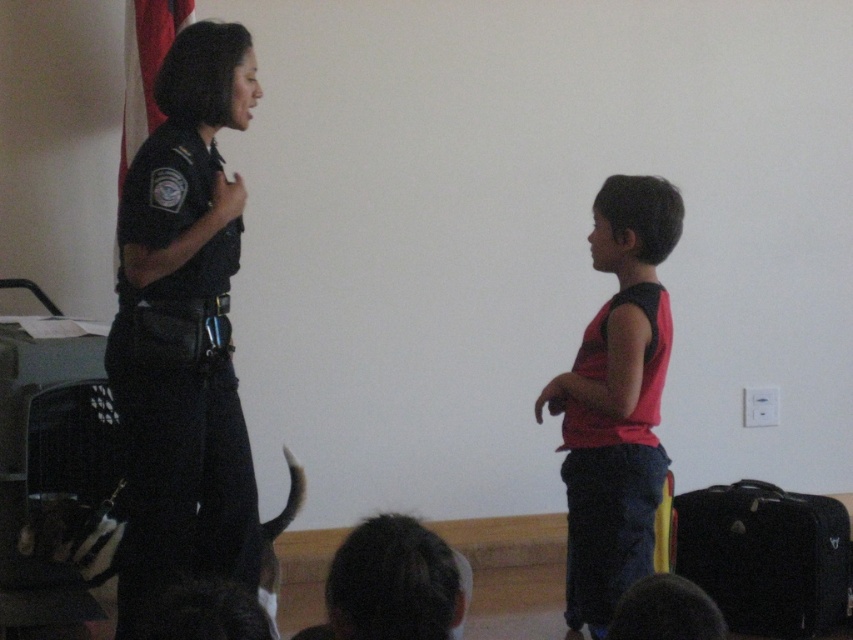
Who is positioned more to the left, red matte tank top at right or black fabric suitcase at lower right?

From the viewer's perspective, red matte tank top at right appears more on the left side.

Does red matte tank top at right appear under black fabric suitcase at lower right?

Actually, red matte tank top at right is above black fabric suitcase at lower right.

Does point (647, 301) come in front of point (691, 512)?

Yes, it is.

This screenshot has width=853, height=640. What are the coordinates of `red matte tank top at right` in the screenshot? It's located at (616, 403).

Does dark blue uniform at left appear on the right side of black fabric suitcase at lower right?

In fact, dark blue uniform at left is to the left of black fabric suitcase at lower right.

Does point (260, 93) lie in front of point (798, 604)?

That is True.

Find the location of a particular element. dark blue uniform at left is located at coordinates (184, 330).

Can you confirm if dark blue uniform at left is bigger than red matte tank top at right?

Correct, dark blue uniform at left is larger in size than red matte tank top at right.

Which is in front, point (241, 220) or point (602, 493)?

Point (241, 220) is in front.

Locate an element on the screen. The width and height of the screenshot is (853, 640). dark blue uniform at left is located at coordinates (184, 330).